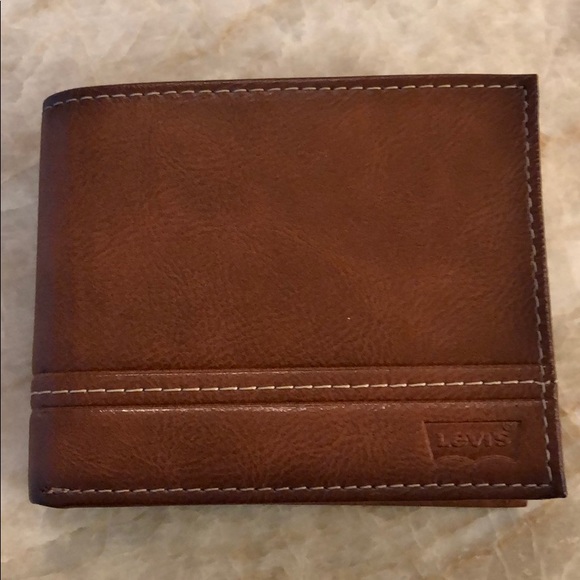
Find the location of `marble`. marble is located at coordinates (9, 535), (574, 195).